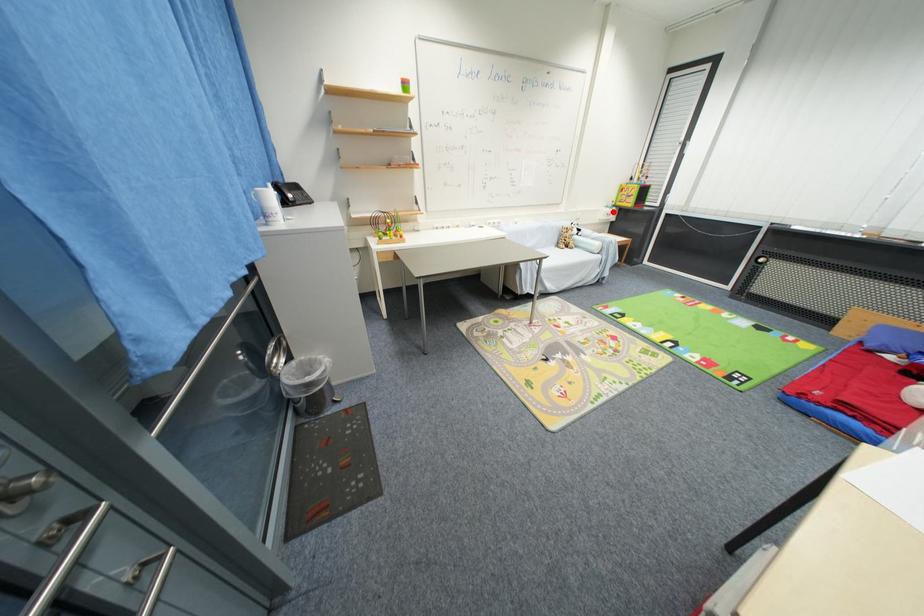
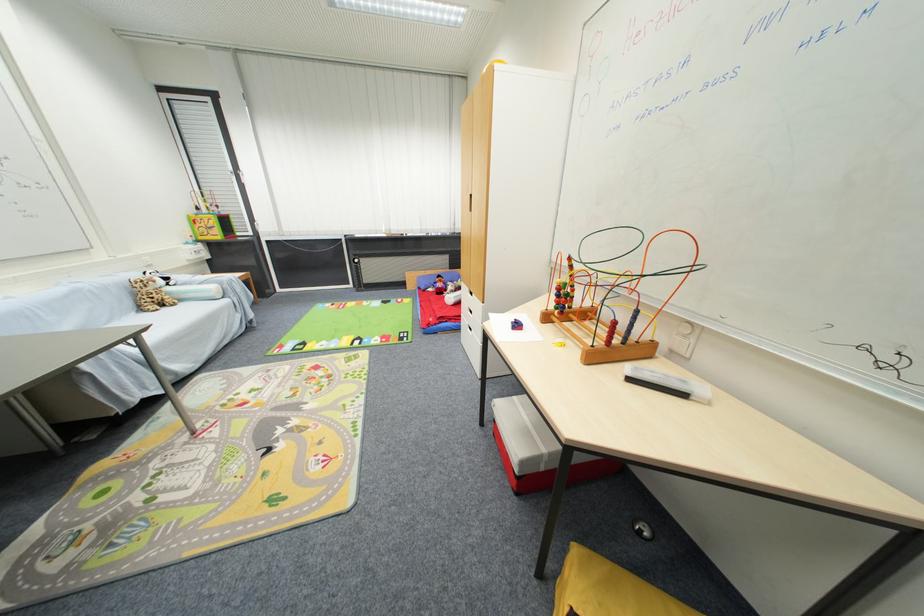
Find the pixel in the second image that matches the highlighted location in the first image.

(198, 249)